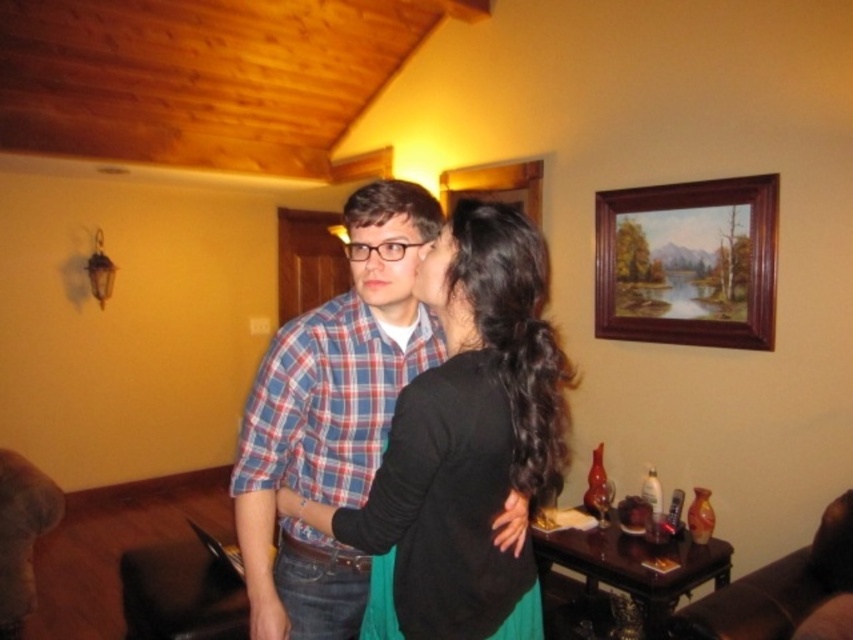
Question: Which of the following is the closest to the observer?

Choices:
 (A) (404, 332)
 (B) (722, 291)

Answer: (A)

Question: From the image, what is the correct spatial relationship of plaid cotton shirt at center in relation to wooden picture frame at upper right?

Choices:
 (A) below
 (B) above

Answer: (A)

Question: Which point is closer to the camera?

Choices:
 (A) plaid cotton shirt at center
 (B) wooden picture frame at upper right

Answer: (A)

Question: Is plaid cotton shirt at center to the left of wooden picture frame at upper right from the viewer's perspective?

Choices:
 (A) no
 (B) yes

Answer: (B)

Question: Which object is farther from the camera taking this photo?

Choices:
 (A) wooden picture frame at upper right
 (B) plaid cotton shirt at center

Answer: (A)

Question: Is plaid cotton shirt at center wider than wooden picture frame at upper right?

Choices:
 (A) no
 (B) yes

Answer: (A)